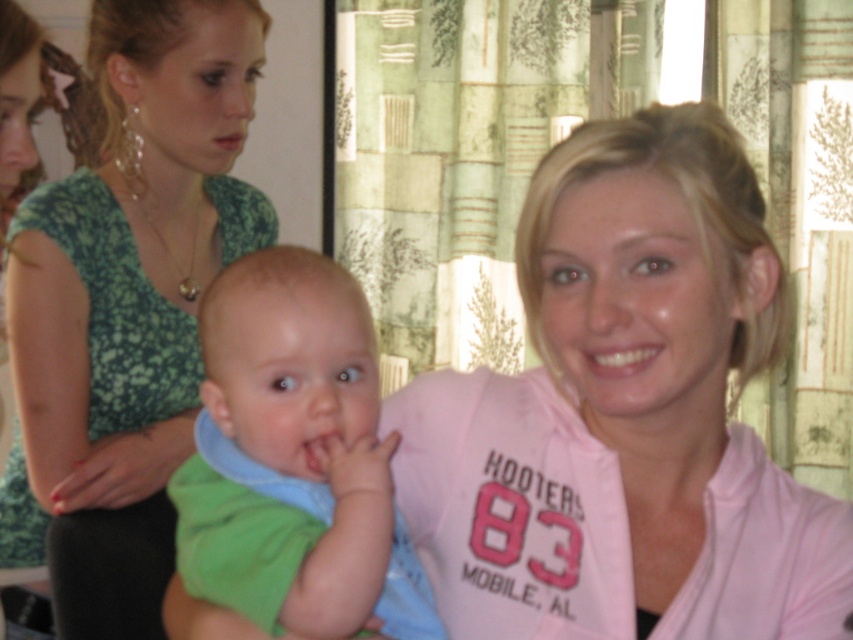
Does green floral dress at upper left appear under green soft fabric baby at center?

No.

Can you confirm if green floral dress at upper left is positioned to the right of green soft fabric baby at center?

In fact, green floral dress at upper left is to the left of green soft fabric baby at center.

This screenshot has width=853, height=640. Describe the element at coordinates (126, 307) in the screenshot. I see `green floral dress at upper left` at that location.

At what (x,y) coordinates should I click in order to perform the action: click on green floral dress at upper left. Please return your answer as a coordinate pair (x, y). This screenshot has width=853, height=640. Looking at the image, I should click on (126, 307).